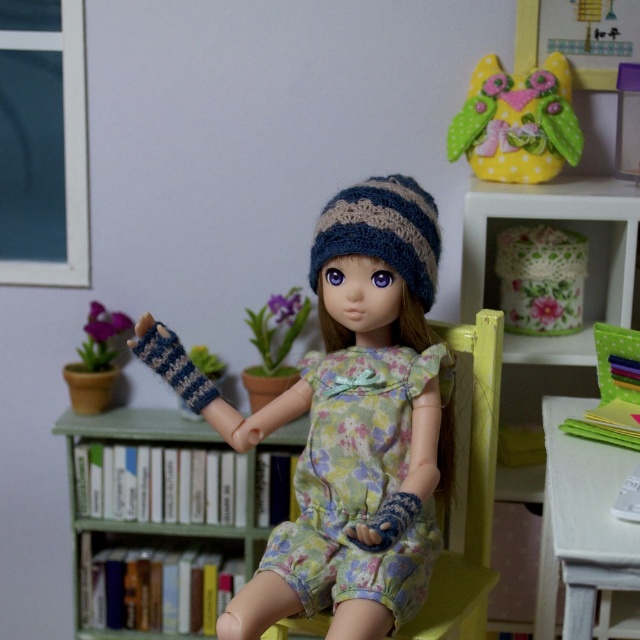
Can you confirm if floral cotton dress at center is taller than floral fabric basket at upper right?

No.

The image size is (640, 640). I want to click on floral cotton dress at center, so click(358, 481).

Which is behind, point (339, 392) or point (625, 321)?

The point (625, 321) is more distant.

Where is `floral cotton dress at center`? The height and width of the screenshot is (640, 640). floral cotton dress at center is located at coordinates (358, 481).

Does floral fabric basket at upper right appear on the right side of floral fabric jar at upper right?

Yes, floral fabric basket at upper right is to the right of floral fabric jar at upper right.

Does floral fabric basket at upper right lie behind floral fabric jar at upper right?

No, it is not.

Is point (616, 314) positioned in front of point (538, 307)?

Yes, it is.

Identify the location of floral fabric basket at upper right. (554, 218).

Is knitted fingerless gloves at center bigger than floral cotton dress at center?

Correct, knitted fingerless gloves at center is larger in size than floral cotton dress at center.

Does knitted fingerless gloves at center lie in front of floral cotton dress at center?

Yes, knitted fingerless gloves at center is closer to the viewer.

Which is in front, point (374, 234) or point (410, 444)?

Positioned in front is point (374, 234).

I want to click on knitted fingerless gloves at center, so click(x=349, y=422).